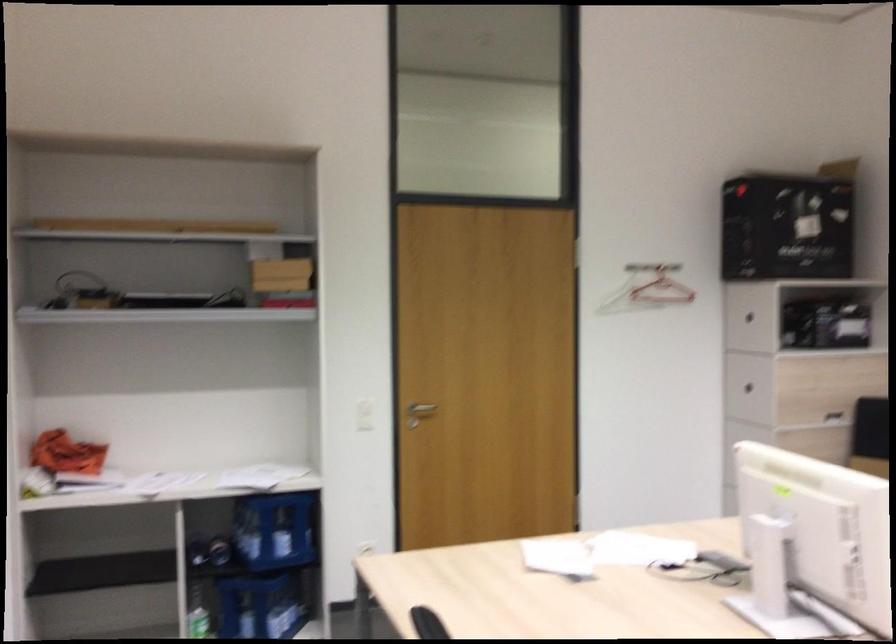
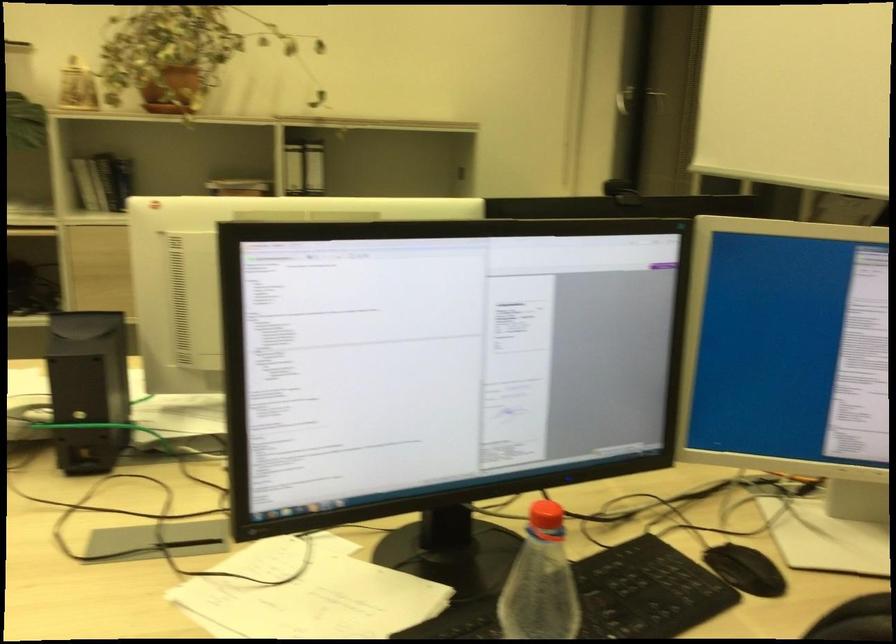
Based on the continuous images, in which direction is the camera rotating?

The camera's rotation is toward right-down.